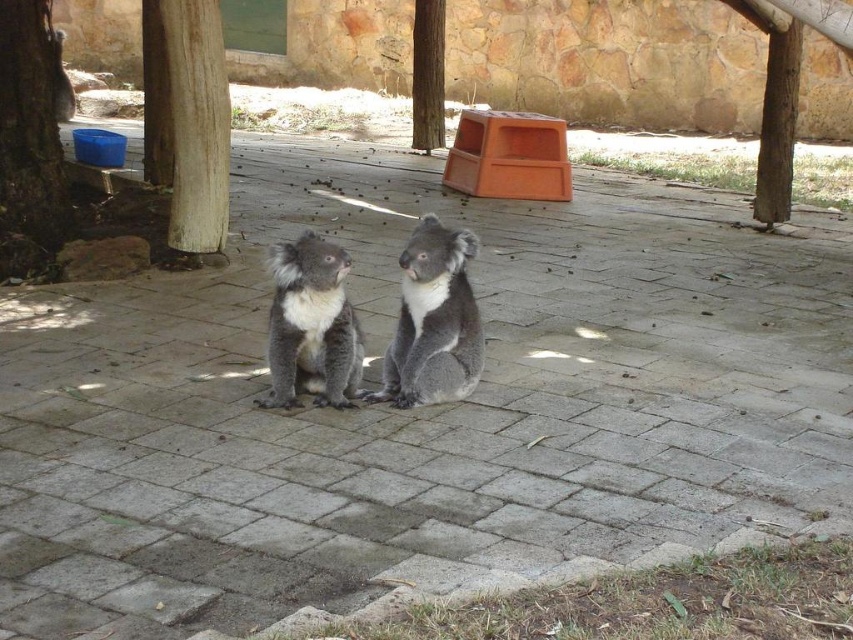
You are a zookeeper trying to locate two specific points in the enclosure. The first point is labeled as point (334, 280) and the second is point (422, 29). Which of these two points is nearer to your current position?

Point (334, 280) is closer to the camera than point (422, 29), so the first point is nearer to your current position.

You are a zookeeper trying to locate two specific points in the enclosure. The first point is at coordinates point (216, 138) and the second is at point (439, 131). Based on the scene description, which point is closer to the observer?

Point (216, 138) is in front of point (439, 131), so it is closer to the observer.

You are a zookeeper observing two koalas in their enclosure. You notice the fuzzy gray koala at center and the fuzzy gray koala at upper center. Which koala is located to the right of the other?

The fuzzy gray koala at center is positioned on the right side of the fuzzy gray koala at upper center.